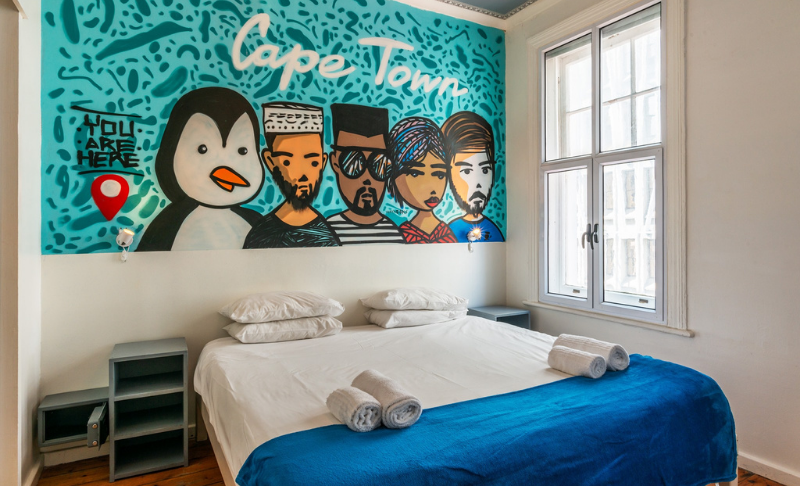
This screenshot has height=486, width=800. I want to click on storage, so 510,310.